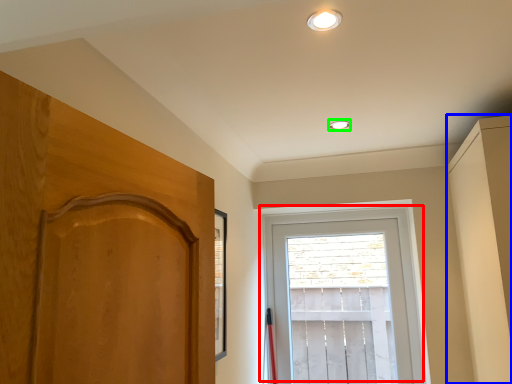
Question: Estimate the real-world distances between objects in this image. Which object is farther from window (highlighted by a red box), dresser (highlighted by a blue box) or lighting (highlighted by a green box)?

Choices:
 (A) dresser
 (B) lighting

Answer: (B)